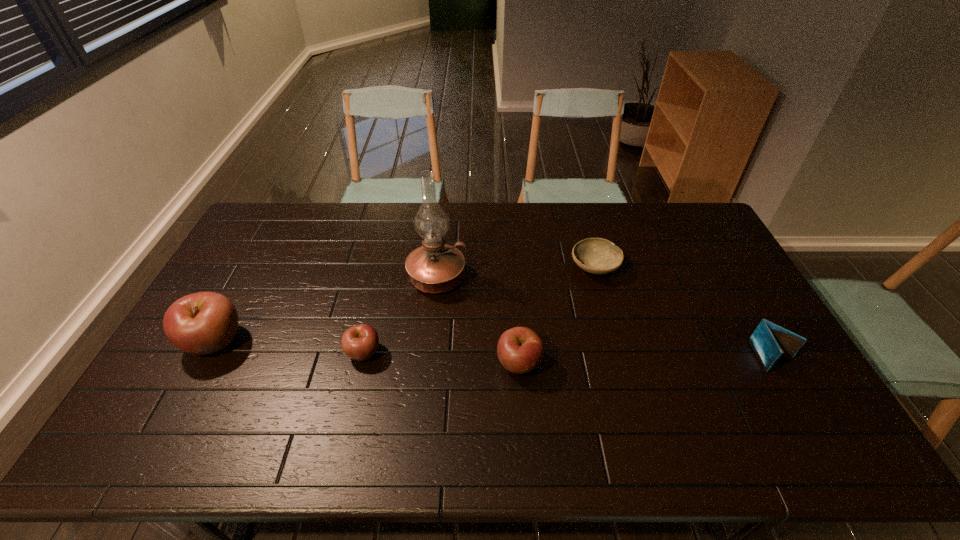
At what (x,y) coordinates should I click in order to perform the action: click on free space between the leftmost object and the oil lamp. Please return your answer as a coordinate pair (x, y). The width and height of the screenshot is (960, 540). Looking at the image, I should click on (326, 310).

Select which object appears as the closest to the rightmost apple. Please provide its 2D coordinates. Your answer should be formatted as a tuple, i.e. [(x, y)], where the tuple contains the x and y coordinates of a point satisfying the conditions above.

[(435, 267)]

Identify which object is the fourth nearest to the leftmost object. Please provide its 2D coordinates. Your answer should be formatted as a tuple, i.e. [(x, y)], where the tuple contains the x and y coordinates of a point satisfying the conditions above.

[(598, 256)]

Select which apple appears as the third closest to the fourth object from right to left. Please provide its 2D coordinates. Your answer should be formatted as a tuple, i.e. [(x, y)], where the tuple contains the x and y coordinates of a point satisfying the conditions above.

[(201, 323)]

This screenshot has height=540, width=960. What are the coordinates of `apple that is the third closest to the rightmost object` in the screenshot? It's located at (201, 323).

What are the coordinates of `free spot that satisfies the following two spatial constraints: 1. on the front side of the tallest object; 2. on the side of the leftmost apple with the unique marking` in the screenshot? It's located at (431, 342).

I want to click on free space in the image that satisfies the following two spatial constraints: 1. on the front side of the bowl; 2. on the side of the second object from left to right with the unique marking, so click(618, 353).